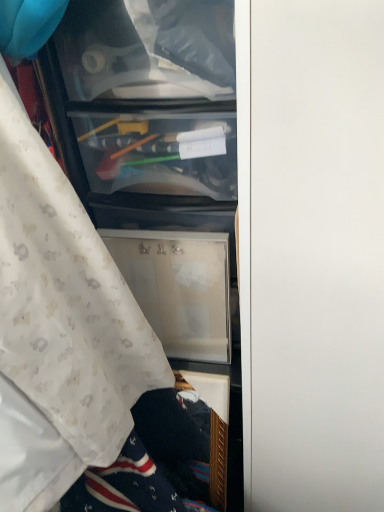
Question: From a real-world perspective, is white textured fabric at left positioned over white matte door at center based on gravity?

Choices:
 (A) no
 (B) yes

Answer: (B)

Question: Can you confirm if white textured fabric at left is thinner than white matte door at center?

Choices:
 (A) no
 (B) yes

Answer: (B)

Question: Would you say white textured fabric at left contains white matte door at center?

Choices:
 (A) no
 (B) yes

Answer: (A)

Question: Considering the relative sizes of white textured fabric at left and white matte door at center in the image provided, is white textured fabric at left taller than white matte door at center?

Choices:
 (A) yes
 (B) no

Answer: (B)

Question: Considering the relative positions of white textured fabric at left and white matte door at center in the image provided, is white textured fabric at left behind white matte door at center?

Choices:
 (A) yes
 (B) no

Answer: (B)

Question: Does white textured fabric at left come in front of white matte door at center?

Choices:
 (A) no
 (B) yes

Answer: (B)

Question: Can you see white matte door at center touching white textured fabric at left?

Choices:
 (A) no
 (B) yes

Answer: (A)

Question: Is white matte door at center facing towards white textured fabric at left?

Choices:
 (A) yes
 (B) no

Answer: (B)

Question: From the image's perspective, is white matte door at center located above white textured fabric at left?

Choices:
 (A) yes
 (B) no

Answer: (B)

Question: Is white matte door at center positioned in front of white textured fabric at left?

Choices:
 (A) yes
 (B) no

Answer: (B)

Question: Is white matte door at center taller than white textured fabric at left?

Choices:
 (A) yes
 (B) no

Answer: (A)

Question: Is white matte door at center wider than white textured fabric at left?

Choices:
 (A) yes
 (B) no

Answer: (A)

Question: In terms of width, does white matte door at center look wider or thinner when compared to white textured fabric at left?

Choices:
 (A) wide
 (B) thin

Answer: (A)